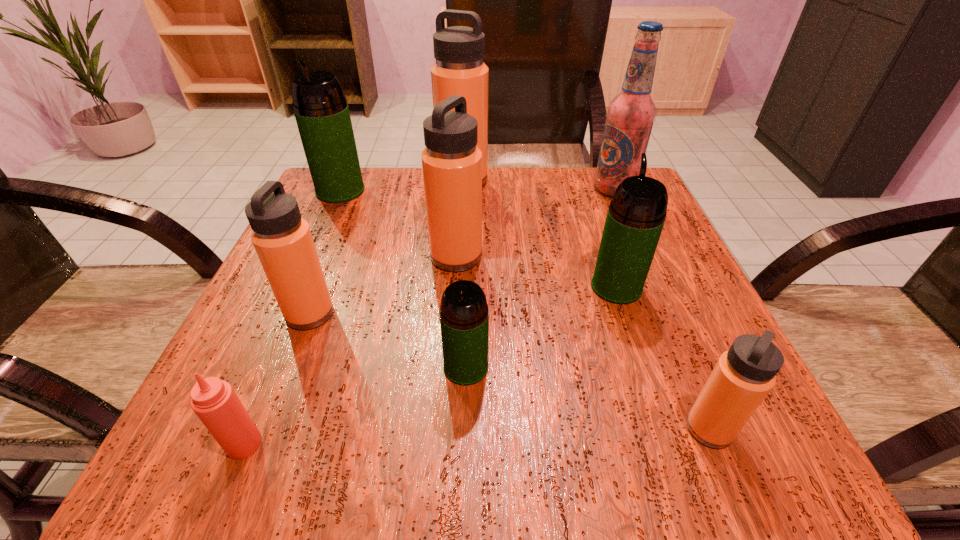
Locate which thermos bottle ranks fifth in proximity to the biggest orange thermos bottle. Please provide its 2D coordinates. Your answer should be formatted as a tuple, i.e. [(x, y)], where the tuple contains the x and y coordinates of a point satisfying the conditions above.

[(464, 317)]

At what (x,y) coordinates should I click in order to perform the action: click on thermos bottle that is the second closest to the leftmost green thermos bottle. Please return your answer as a coordinate pair (x, y). Looking at the image, I should click on (451, 162).

Locate an element on the screen. orange thermos bottle that stands as the third closest to the alcohol is located at coordinates (743, 376).

Identify which orange thermos bottle is the second closest to the Tabasco sauce. Please provide its 2D coordinates. Your answer should be formatted as a tuple, i.e. [(x, y)], where the tuple contains the x and y coordinates of a point satisfying the conditions above.

[(451, 162)]

Identify the location of the second closest green thermos bottle to the blue alcohol. This screenshot has height=540, width=960. (464, 317).

Image resolution: width=960 pixels, height=540 pixels. Identify the location of green thermos bottle that is the second closest to the second green thermos bottle from right to left. (321, 111).

What are the coordinates of `free location that satisfies the following two spatial constraints: 1. from the spout of the second smallest green thermos bottle; 2. on the right side of the alcohol` in the screenshot? It's located at (584, 189).

Find the location of `vacant area that satisfies the following two spatial constraints: 1. on the back side of the second biggest orange thermos bottle; 2. on the right side of the shortest object`. vacant area that satisfies the following two spatial constraints: 1. on the back side of the second biggest orange thermos bottle; 2. on the right side of the shortest object is located at coordinates (323, 256).

The image size is (960, 540). What are the coordinates of `vacant region that satisfies the following two spatial constraints: 1. from the spout of the Tabasco sauce; 2. on the left side of the farthest green thermos bottle` in the screenshot? It's located at (228, 444).

You are a GUI agent. You are given a task and a screenshot of the screen. Output one action in this format:
    pyautogui.click(x=<x>, y=<y>)
    Task: Click on the vacant position in the image that satisfies the following two spatial constraints: 1. on the back side of the biggest orange thermos bottle; 2. on the right side of the second biggest orange thermos bottle
    This screenshot has width=960, height=540.
    Given the screenshot: What is the action you would take?
    pyautogui.click(x=461, y=180)